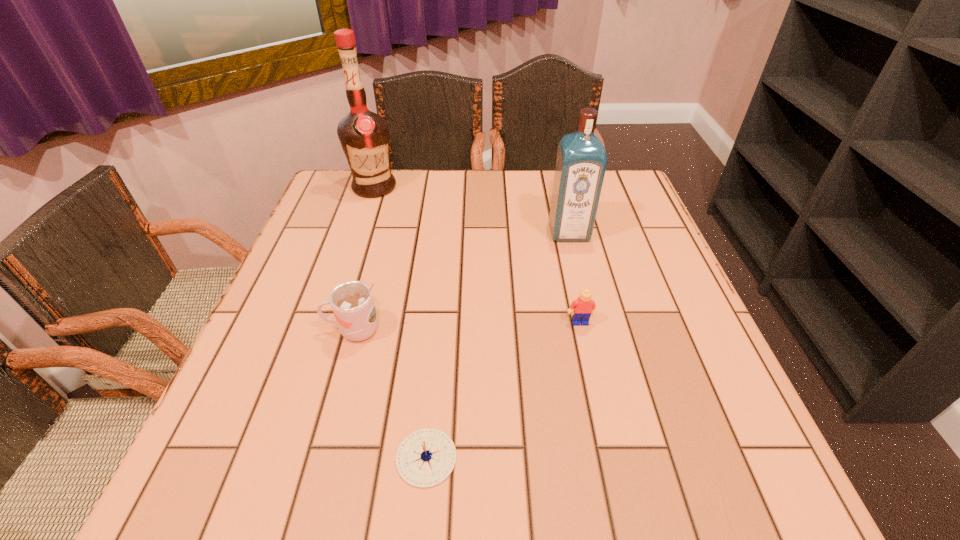
Locate an element on the screen. The width and height of the screenshot is (960, 540). vacant space located 0.050m on the side with the handle of the cup is located at coordinates (299, 330).

I want to click on free space located on the side with the handle of the cup, so click(x=288, y=330).

Locate an element on the screen. free space located 0.110m on the side with the handle of the cup is located at coordinates (268, 330).

Find the location of a particular element. The height and width of the screenshot is (540, 960). vacant space located 0.140m on the face of the Lego is located at coordinates (594, 387).

At what (x,y) coordinates should I click in order to perform the action: click on vacant space situated on the right of the shortest object. Please return your answer as a coordinate pair (x, y). The height and width of the screenshot is (540, 960). Looking at the image, I should click on (515, 457).

Locate an element on the screen. The image size is (960, 540). object that is at the far edge is located at coordinates (364, 136).

Identify the location of object located in the near edge section of the desktop. The width and height of the screenshot is (960, 540). click(425, 458).

You are a GUI agent. You are given a task and a screenshot of the screen. Output one action in this format:
    pyautogui.click(x=<x>, y=<y>)
    Task: Click on the liquor that is at the left edge
    This screenshot has height=540, width=960.
    Given the screenshot: What is the action you would take?
    pyautogui.click(x=364, y=136)

You are a GUI agent. You are given a task and a screenshot of the screen. Output one action in this format:
    pyautogui.click(x=<x>, y=<y>)
    Task: Click on the cup situated at the left edge
    
    Given the screenshot: What is the action you would take?
    pyautogui.click(x=352, y=302)

Where is `object that is at the far left corner`? The width and height of the screenshot is (960, 540). object that is at the far left corner is located at coordinates (364, 136).